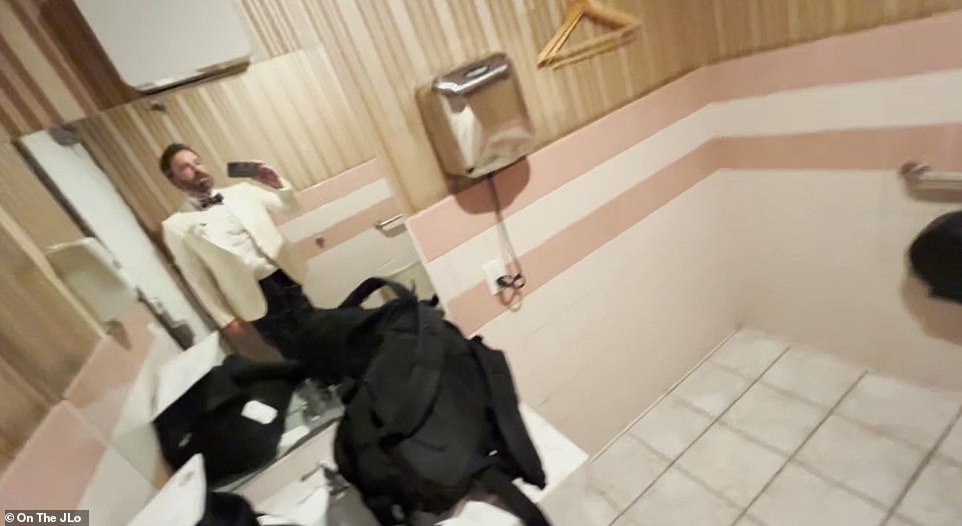
I want to click on toilet paper, so click(926, 251).